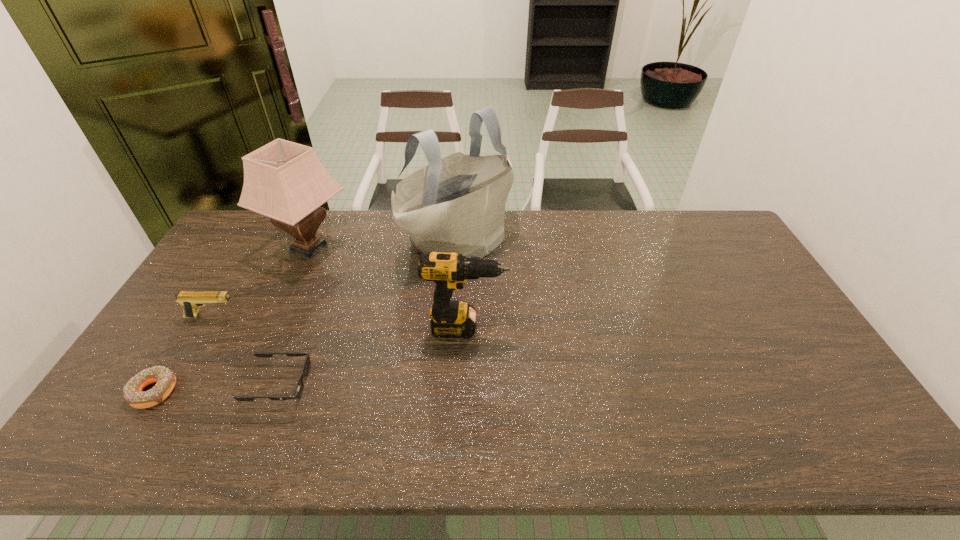
Locate an element on the screen. This screenshot has width=960, height=540. object that can be found as the third closest to the doughnut is located at coordinates (283, 180).

Locate which object ranks in proximity to the pistol. Please provide its 2D coordinates. Your answer should be formatted as a tuple, i.e. [(x, y)], where the tuple contains the x and y coordinates of a point satisfying the conditions above.

[(283, 180)]

Identify the location of vacant space that satisfies the following two spatial constraints: 1. at the barrel of the third shortest object; 2. on the front side of the doughnut. The width and height of the screenshot is (960, 540). (169, 391).